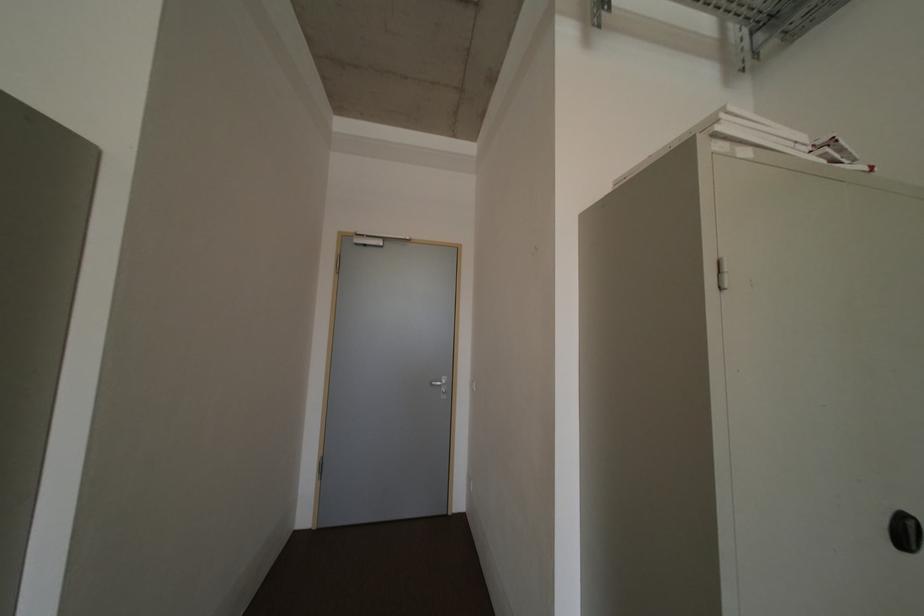
Find where to pull the black cabinet handle. Please return your answer as a coordinate pair (x, y).

(905, 532)